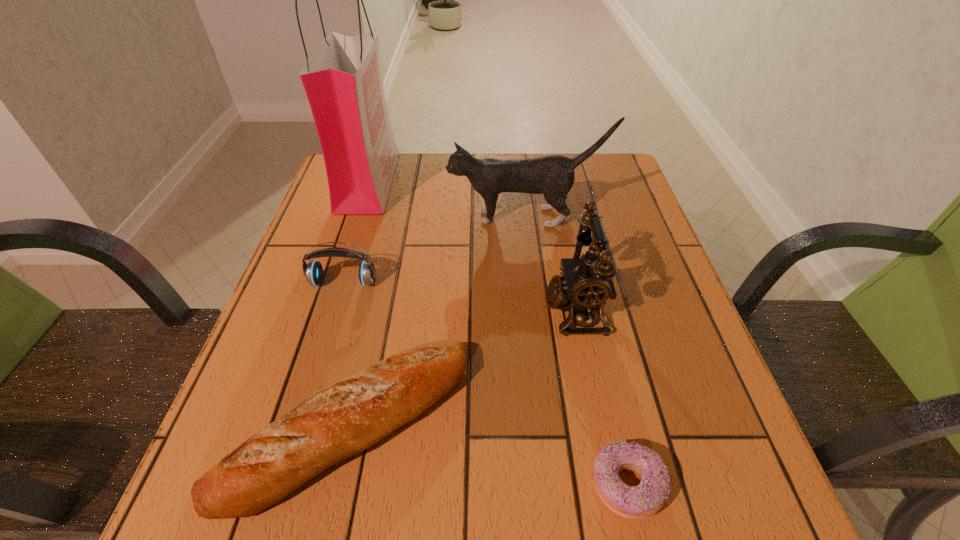
The width and height of the screenshot is (960, 540). I want to click on vacant space that satisfies the following two spatial constraints: 1. at the face of the cat; 2. on the front side of the baguet, so click(550, 426).

In order to click on free space that satisfies the following two spatial constraints: 1. on the ear cups of the third shortest object; 2. on the left side of the baguet in this screenshot , I will do `click(300, 426)`.

In order to click on vacant space that satisfies the following two spatial constraints: 1. on the rotary dial of the third tallest object; 2. on the left side of the shortest object in this screenshot , I will do `click(610, 485)`.

Where is `vacant space that satisfies the following two spatial constraints: 1. at the face of the fifth shortest object; 2. on the right side of the doughnut`? vacant space that satisfies the following two spatial constraints: 1. at the face of the fifth shortest object; 2. on the right side of the doughnut is located at coordinates (557, 485).